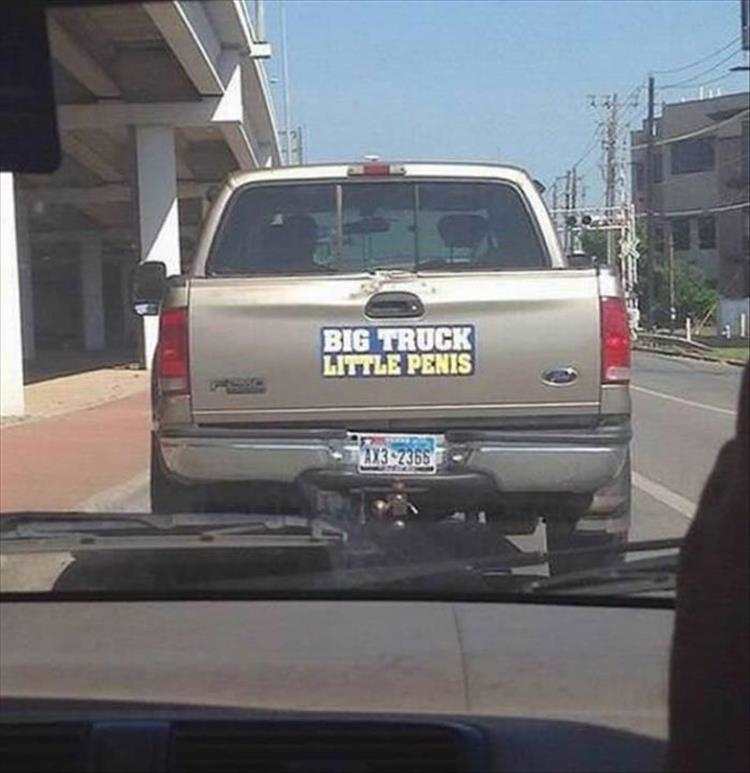
Locate an element on the screen. pillar is located at coordinates (14, 288), (169, 193).